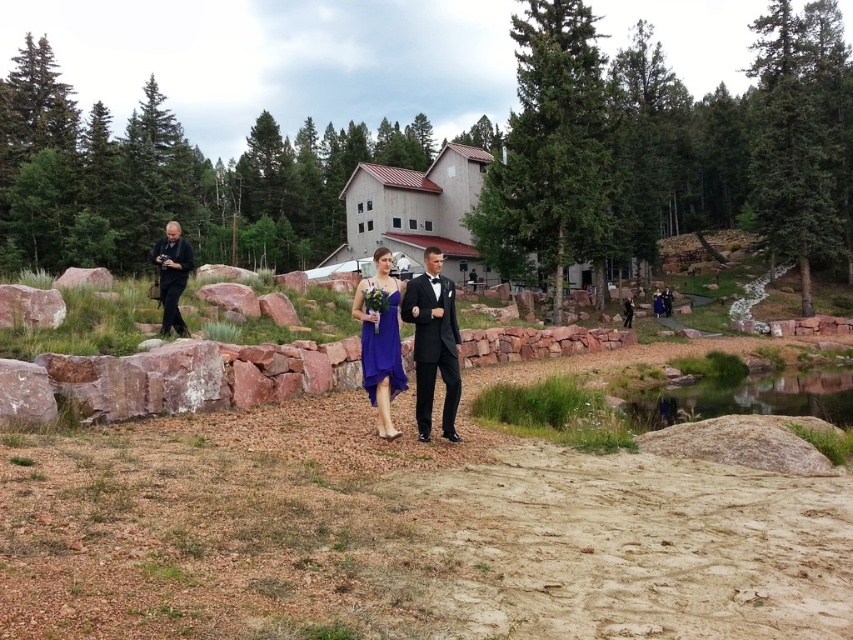
You are a photographer at the wedding venue. You need to position a spotlight exactly at the coordinates point (433, 342). According to the image, what object is located at that point?

The shiny black suit at center is located at point (433, 342).

You are a photographer at the wedding venue. You need to position a spotlight so it shines on both the shiny black suit at center and the satin blue dress at center. Since the spotlight can only illuminate one object directly, which object should you aim it at to ensure both are lit?

You should aim the spotlight at the shiny black suit at center because it is in front of the satin blue dress at center, so the light will naturally spill onto the dress behind it.

You are a photographer holding the black matte camera at left and want to take a photo of the shiny black suit at center. Since both are black, how can you ensure the camera won not blend into the suit?

The shiny black suit at center is larger in size than the black matte camera at left, so positioning the camera closer to the subject will help distinguish its smaller size against the larger suit.